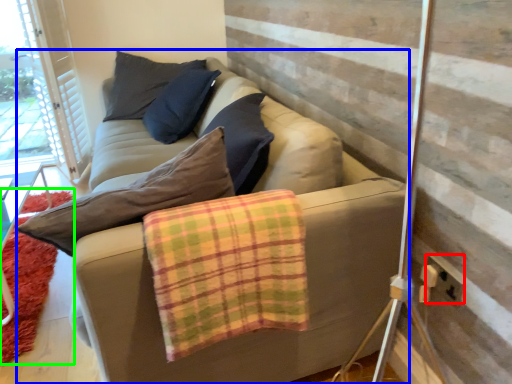
Question: Considering the real-world distances, which object is closest to electric outlet (highlighted by a red box)? studio couch (highlighted by a blue box) or mat (highlighted by a green box).

Choices:
 (A) studio couch
 (B) mat

Answer: (A)